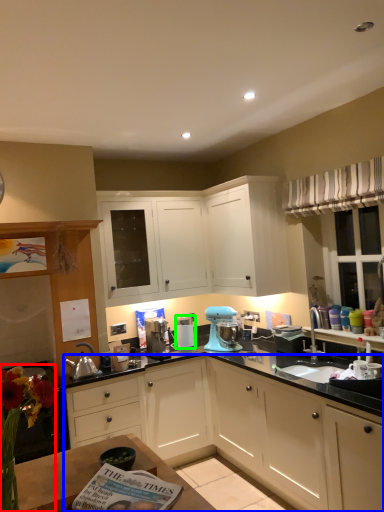
Question: Based on their relative distances, which object is farther from floral arrangement (highlighted by a red box)? Choose from cabinetry (highlighted by a blue box) and appliance (highlighted by a green box).

Choices:
 (A) cabinetry
 (B) appliance

Answer: (B)